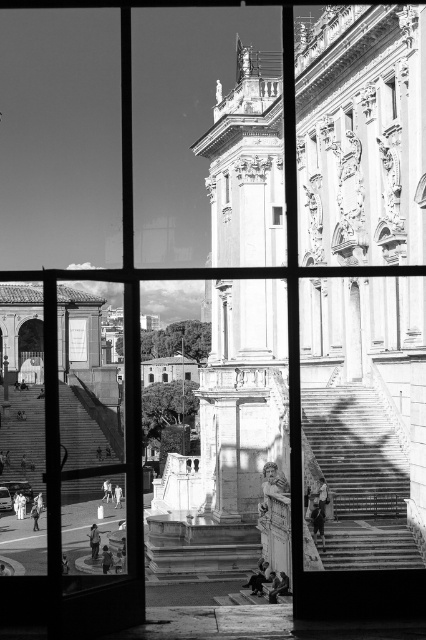
Question: Which of these objects is positioned closest to the smooth concrete stairs at lower right?

Choices:
 (A) stone staircase at lower left
 (B) transparent glass window at center

Answer: (A)

Question: Which of the following is the farthest from the observer?

Choices:
 (A) (23, 476)
 (B) (281, 216)

Answer: (A)

Question: Does smooth concrete stairs at lower right appear on the left side of stone staircase at lower left?

Choices:
 (A) no
 (B) yes

Answer: (A)

Question: Does smooth concrete stairs at lower right appear on the right side of transparent glass window at center?

Choices:
 (A) no
 (B) yes

Answer: (B)

Question: Which point is farther to the camera?

Choices:
 (A) smooth concrete stairs at lower right
 (B) transparent glass window at center

Answer: (B)

Question: Is smooth concrete stairs at lower right positioned before transparent glass window at center?

Choices:
 (A) yes
 (B) no

Answer: (A)